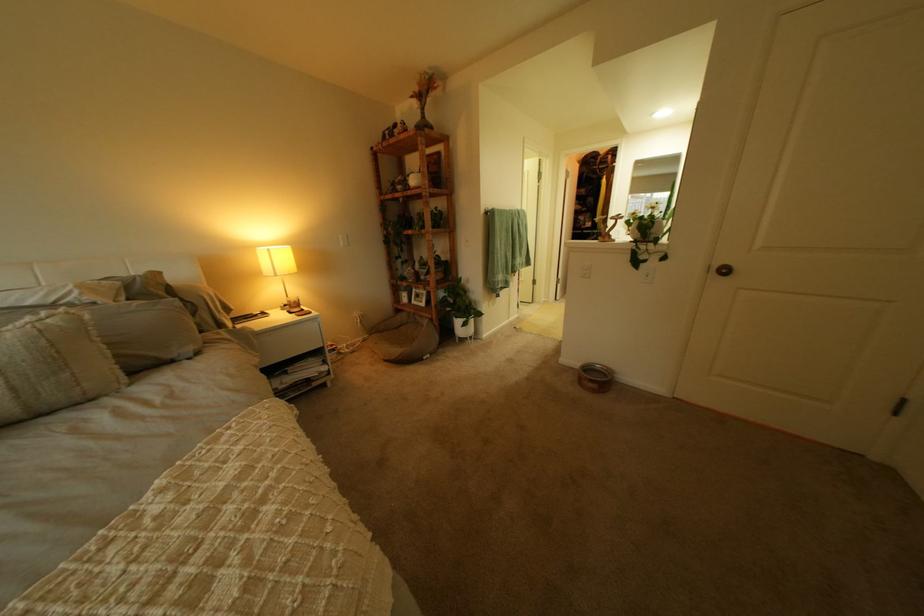
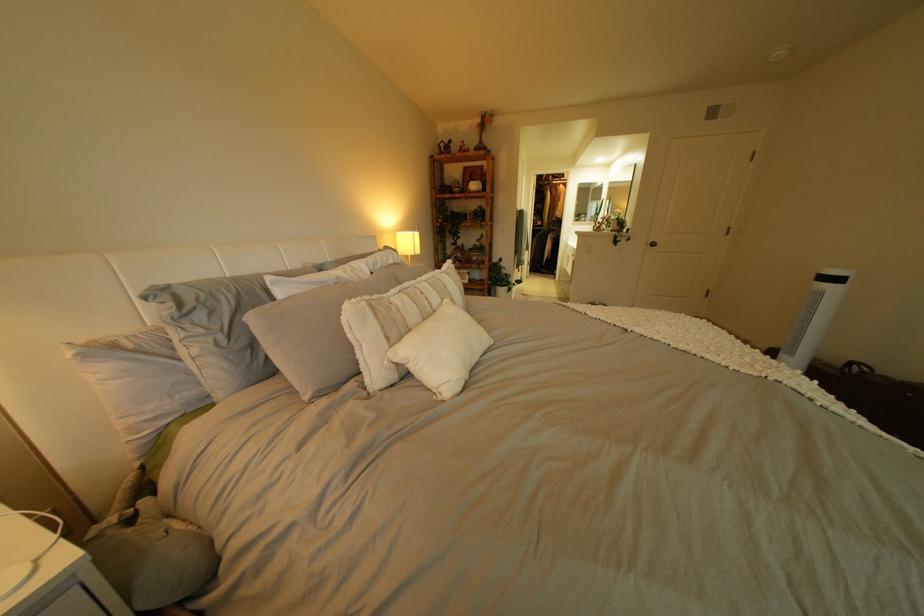
Question: The images are taken continuously from a first-person perspective. In which direction are you moving?

Choices:
 (A) Left
 (B) Right
 (C) Forward
 (D) Backward

Answer: (A)